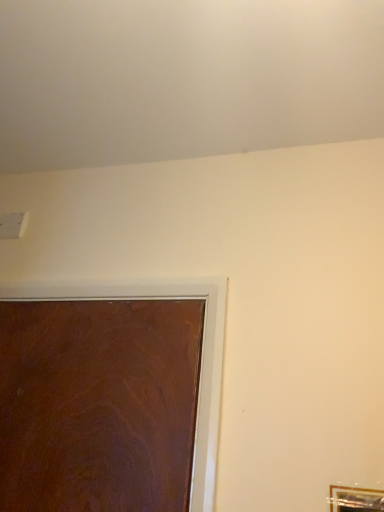
The height and width of the screenshot is (512, 384). What do you see at coordinates (355, 499) in the screenshot? I see `wooden framed picture at lower right` at bounding box center [355, 499].

Locate an element on the screen. The width and height of the screenshot is (384, 512). wooden framed picture at lower right is located at coordinates (355, 499).

Image resolution: width=384 pixels, height=512 pixels. In order to click on wooden framed picture at lower right in this screenshot , I will do `click(355, 499)`.